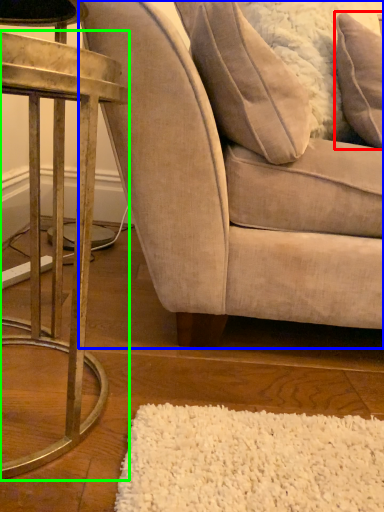
Question: Which object is the farthest from pillow (highlighted by a red box)? Choose among these: chair (highlighted by a blue box) or table (highlighted by a green box).

Choices:
 (A) chair
 (B) table

Answer: (B)